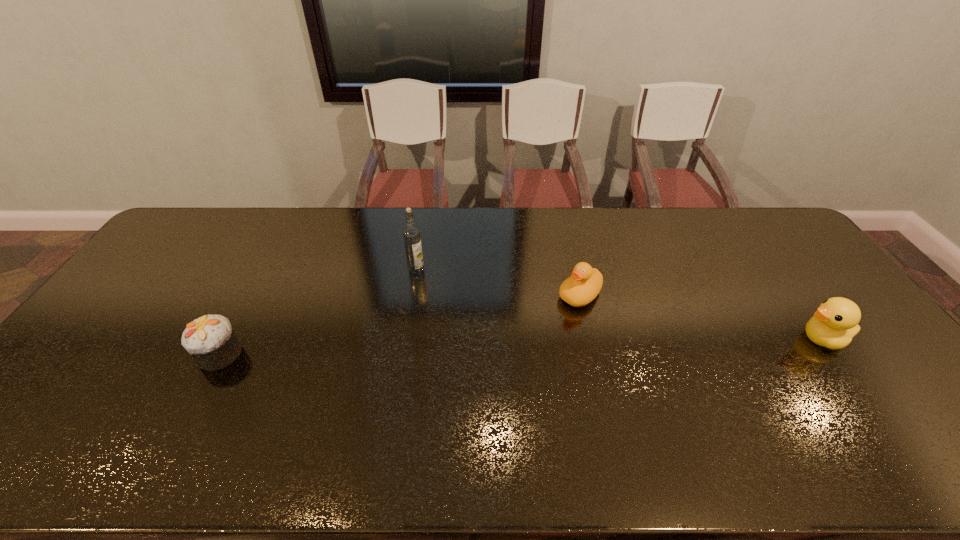
Image resolution: width=960 pixels, height=540 pixels. I want to click on vacant space at the left edge, so click(x=163, y=305).

Where is `free location at the right edge of the desktop`? Image resolution: width=960 pixels, height=540 pixels. free location at the right edge of the desktop is located at coordinates (768, 259).

This screenshot has width=960, height=540. In order to click on vacant space at the far left corner of the desktop in this screenshot , I will do `click(220, 229)`.

The height and width of the screenshot is (540, 960). Identify the location of vacant region between the leftmost object and the right duck. (521, 346).

Where is `free point between the leftmost object and the second object from right to left`? Image resolution: width=960 pixels, height=540 pixels. free point between the leftmost object and the second object from right to left is located at coordinates (400, 325).

Identify the location of free spot between the third nearest object and the cupcake. Image resolution: width=960 pixels, height=540 pixels. (400, 325).

I want to click on unoccupied area between the right duck and the vodka, so click(620, 305).

Locate an element on the screen. This screenshot has height=540, width=960. free spot between the tallest object and the leftmost object is located at coordinates (318, 312).

You are a GUI agent. You are given a task and a screenshot of the screen. Output one action in this format:
    pyautogui.click(x=<x>, y=<y>)
    Task: Click on the unoccupied area between the second object from right to left and the nearer duck
    The height and width of the screenshot is (540, 960).
    Given the screenshot: What is the action you would take?
    pyautogui.click(x=702, y=317)

Locate an element on the screen. This screenshot has width=960, height=540. free spot between the second object from right to left and the farthest object is located at coordinates (498, 283).